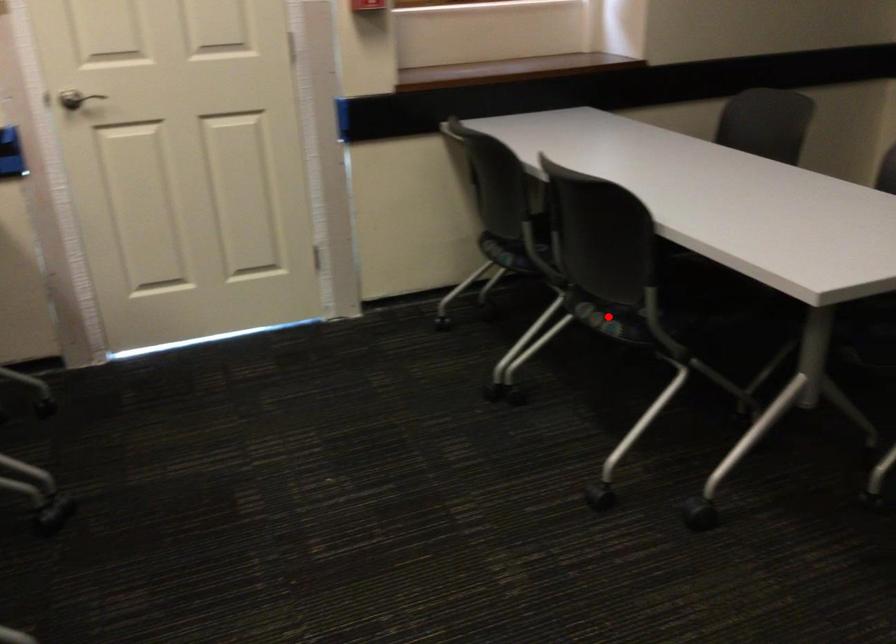
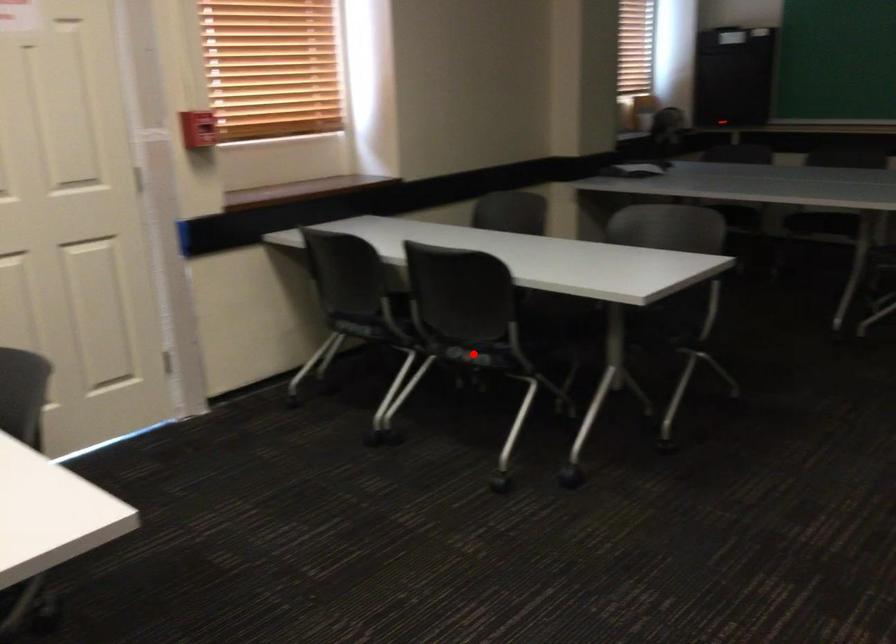
I am providing you with two images of the same scene from different viewpoints. A red point is marked on the first image and another point is marked on the second image. Do the highlighted points in image1 and image2 indicate the same real-world spot?

Yes